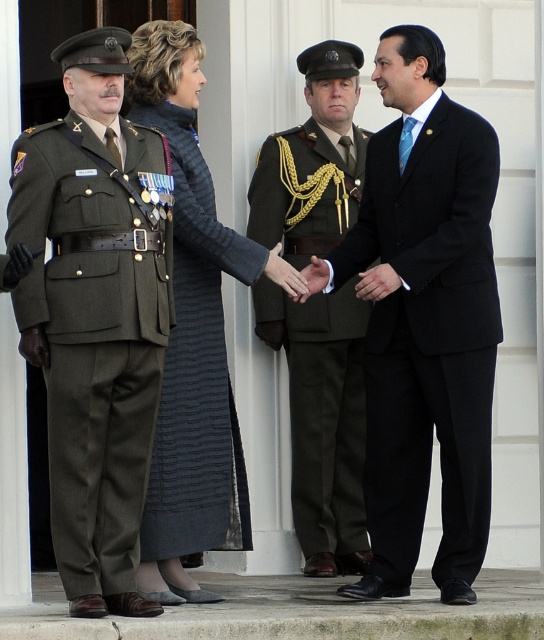
You are attending a formal event and notice two individuals in the scene. One is wearing a green fabric uniform at left, and the other is in a black satin suit at center. Based on their positions, which individual is closer to the entrance of the event venue?

The black satin suit at center is to the right of the green fabric uniform at left, so the black satin suit at center is closer to the entrance if the entrance is on the right side of the scene.

You are a photographer at a formal event. You need to position yourself to capture a photo of the black satin suit at center. According to the scene description, where should you aim your camera?

The black satin suit at center is located at point (423, 320), so you should aim your camera at those coordinates to capture it.